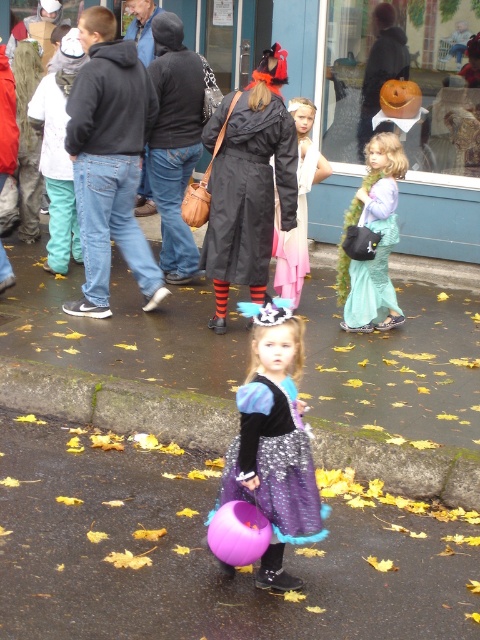
Does sparkly purple dress at center have a lesser height compared to teal satin dress at right?

Yes, sparkly purple dress at center is shorter than teal satin dress at right.

From the picture: Which is below, sparkly purple dress at center or teal satin dress at right?

Positioned lower is sparkly purple dress at center.

Does point (278, 433) come closer to viewer compared to point (391, 241)?

Yes, it is in front of point (391, 241).

Find the location of a particular element. The image size is (480, 640). sparkly purple dress at center is located at coordinates (274, 461).